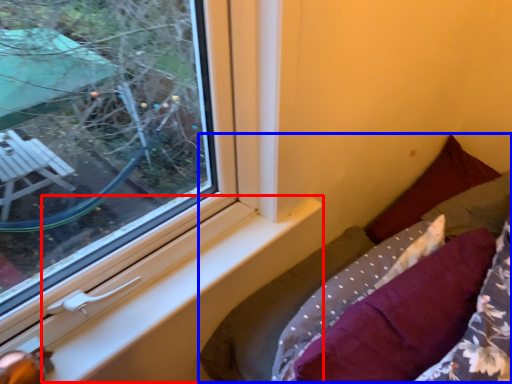
Question: Which of the following is the farthest to the observer, window sill (highlighted by a red box) or bed (highlighted by a blue box)?

Choices:
 (A) window sill
 (B) bed

Answer: (B)